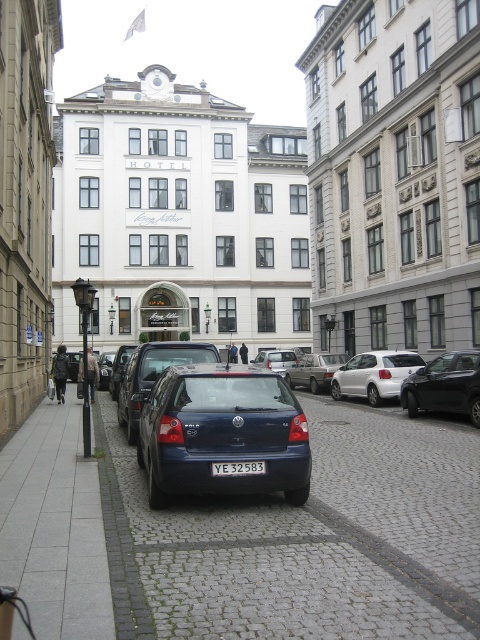
Question: Where is gray concrete sidewalk at lower left located in relation to yellow metallic license plate at center in the image?

Choices:
 (A) above
 (B) below

Answer: (B)

Question: Which point is farther from the camera taking this photo?

Choices:
 (A) (145, 413)
 (B) (245, 464)
 (C) (186, 355)

Answer: (C)

Question: Which point is closer to the camera?

Choices:
 (A) blue matte car at center
 (B) matte blue hatchback at center

Answer: (B)

Question: Is gray concrete sidewalk at lower left closer to the viewer compared to white matte hatchback at center?

Choices:
 (A) no
 (B) yes

Answer: (B)

Question: Among these objects, which one is nearest to the camera?

Choices:
 (A) gray concrete sidewalk at lower left
 (B) yellow metallic license plate at center

Answer: (A)

Question: Is the position of gray concrete sidewalk at lower left less distant than that of white matte hatchback at center?

Choices:
 (A) yes
 (B) no

Answer: (A)